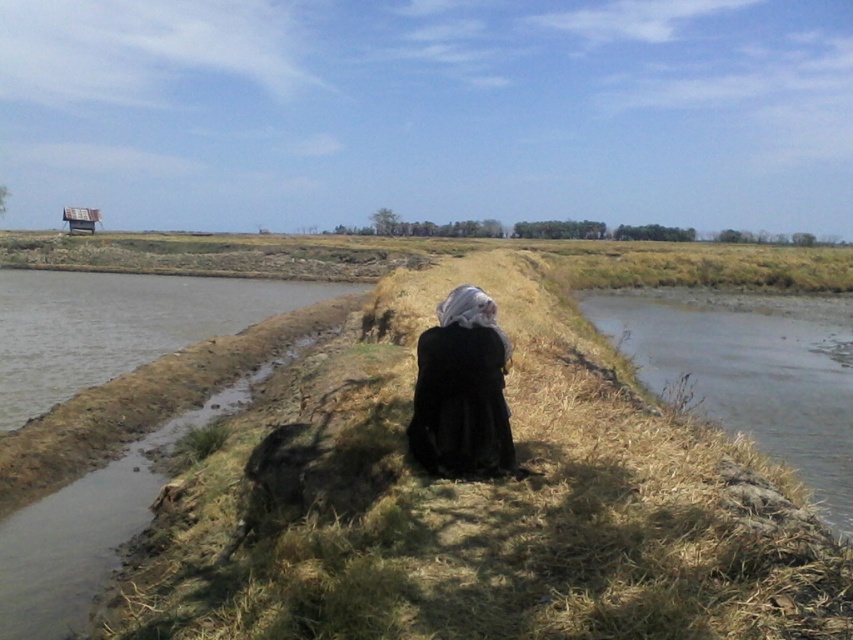
You are standing at the point labeled point [254,572] and want to walk to the point labeled point [463,316]. Which direction should you move in to get closer to your destination?

You should move away from the camera because point [254,572] is closer to the camera than point [463,316]. Moving away from the camera would take you towards the farther point.

You are a photographer planning to capture a closeup shot of the dry grass at center and the black matte dress at center. Which object should you focus on first if you want to ensure both are in focus without adjusting your camera settings?

The dry grass at center has a greater height compared to the black matte dress at center, so focusing on the dry grass at center first would ensure both are in focus since it is taller and requires a closer focus point.